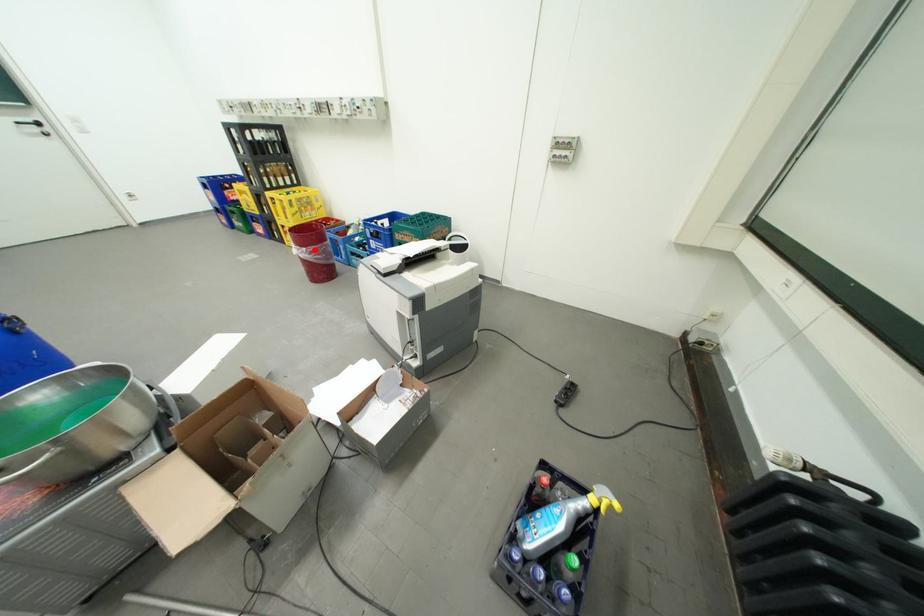
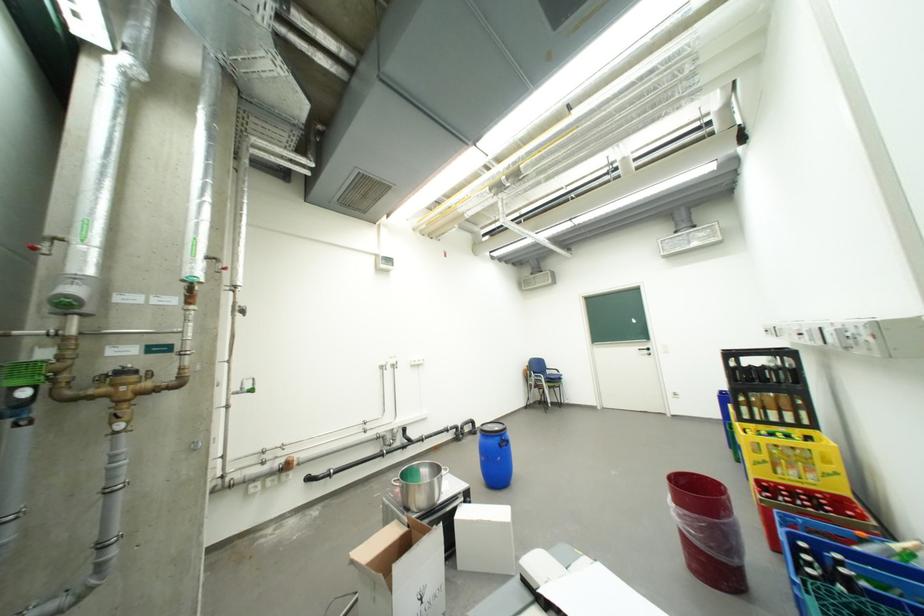
Where in the second image is the point corresponding to the highlighted location from the first image?

(685, 507)